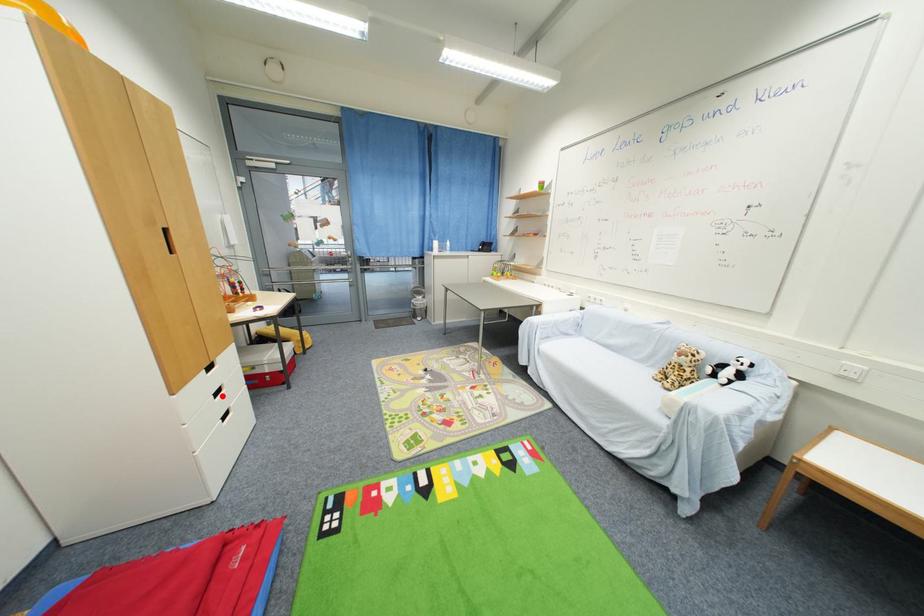
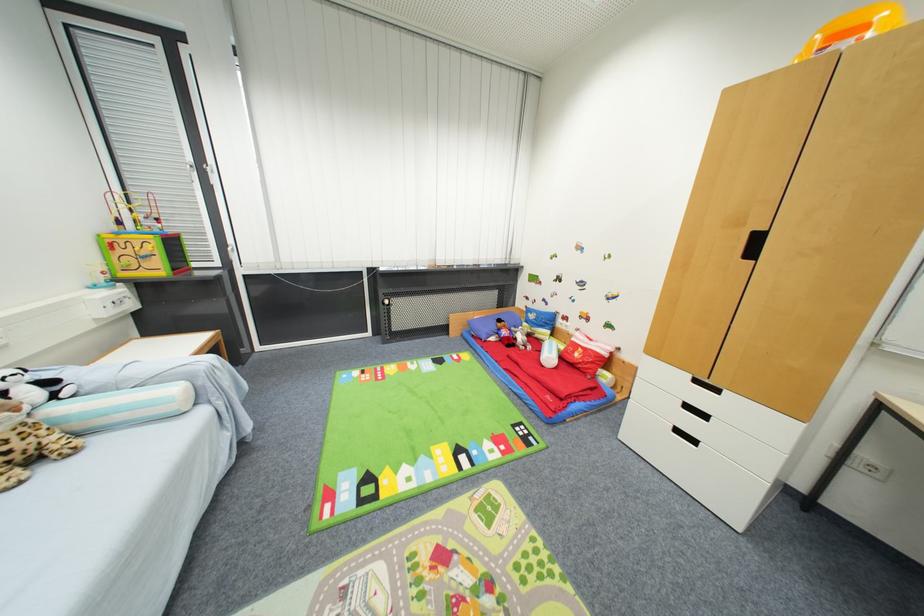
The point at the highlighted location is marked in the first image. Where is the corresponding point in the second image?

(691, 408)